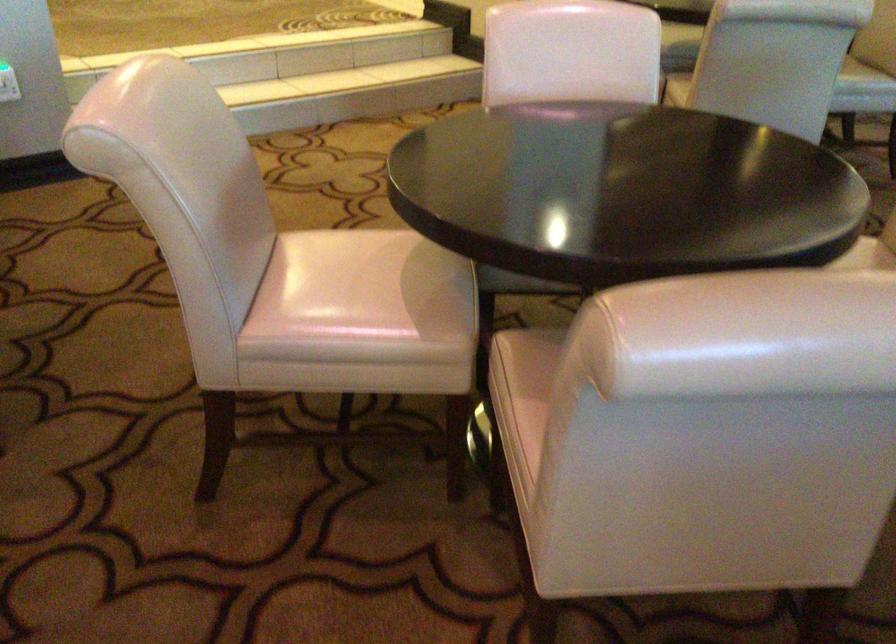
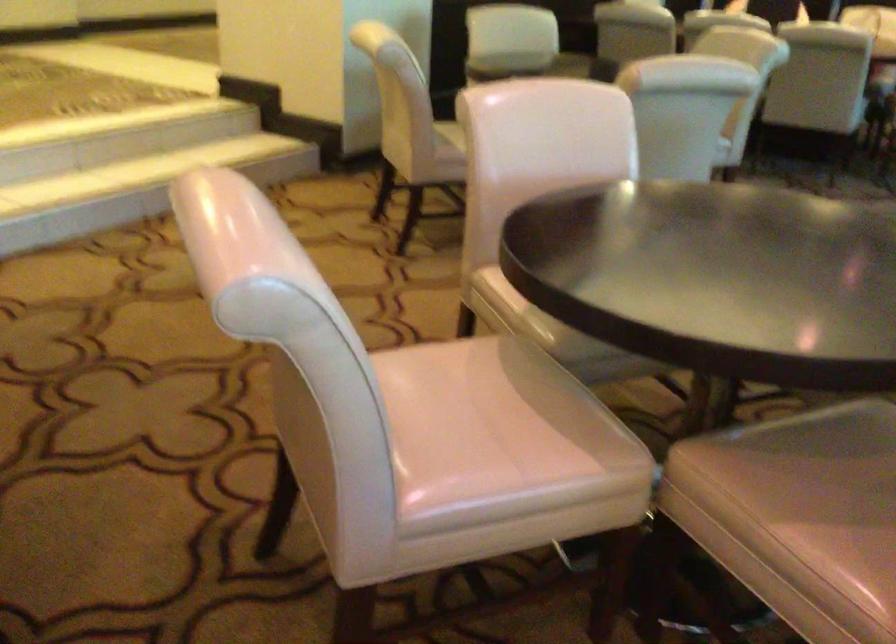
Question: The first image is from the beginning of the video and the second image is from the end. How did the camera likely rotate when shooting the video?

Choices:
 (A) Left
 (B) Right
 (C) Up
 (D) Down

Answer: (B)